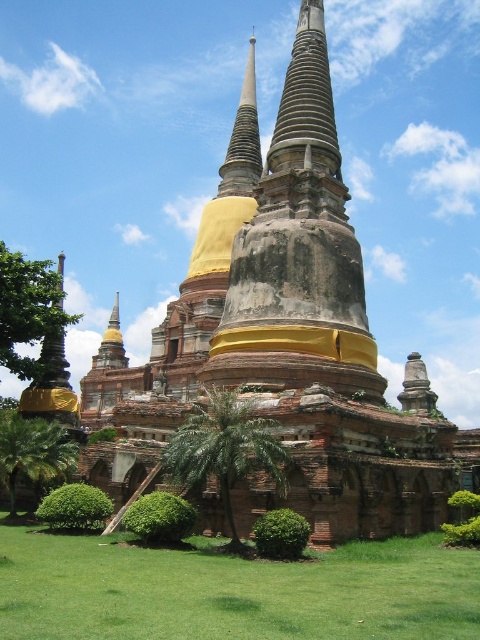
Question: Which of the following is the farthest from the observer?

Choices:
 (A) yellow stone pagoda at center
 (B) green leafy tree at left
 (C) green grass at lower center

Answer: (B)

Question: Which point appears farthest from the camera in this image?

Choices:
 (A) (220, 401)
 (B) (73, 460)
 (C) (25, 372)
 (D) (228, 189)

Answer: (D)

Question: Which object is farther from the camera taking this photo?

Choices:
 (A) green leafy tree at left
 (B) green leafy palm at center

Answer: (A)

Question: Does green leafy tree at left appear under green leafy tree at lower left?

Choices:
 (A) no
 (B) yes

Answer: (A)

Question: Is green grass at lower center positioned at the back of smooth gold spire at center?

Choices:
 (A) yes
 (B) no

Answer: (B)

Question: Is yellow stone pagoda at center to the left of green leafy palm at center from the viewer's perspective?

Choices:
 (A) no
 (B) yes

Answer: (A)